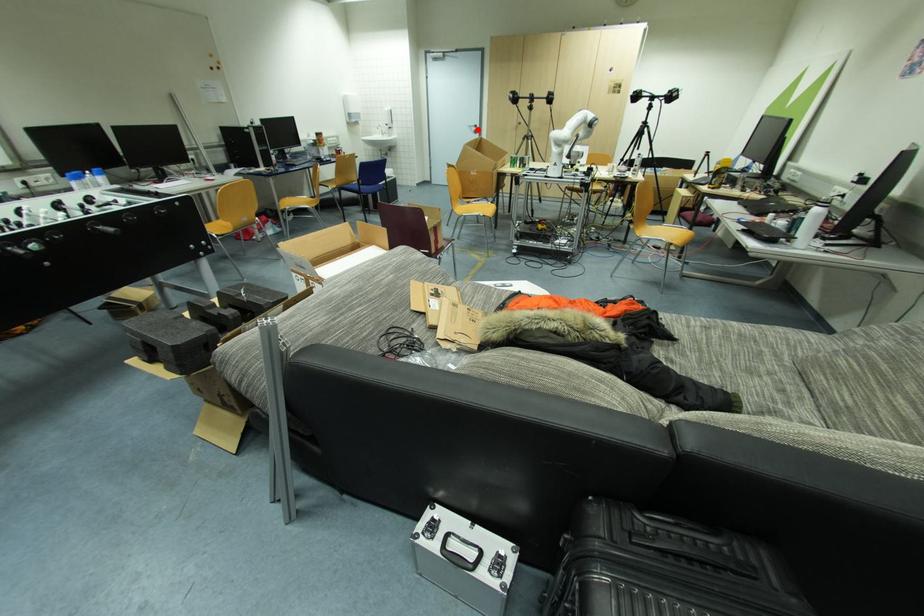
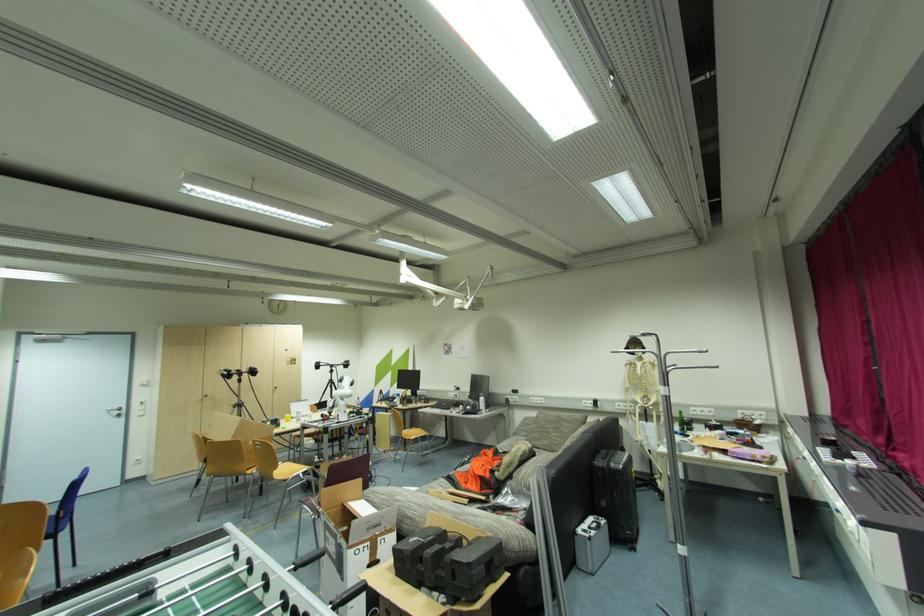
Find the pixel in the second image that matches the highlighted location in the first image.

(122, 413)